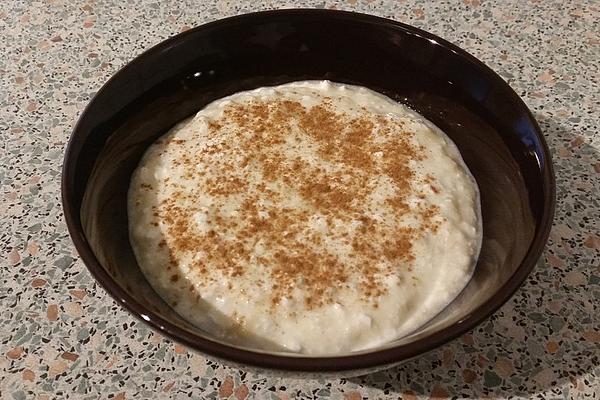
Where is `inside face of bowl`? Image resolution: width=600 pixels, height=400 pixels. inside face of bowl is located at coordinates (159, 86).